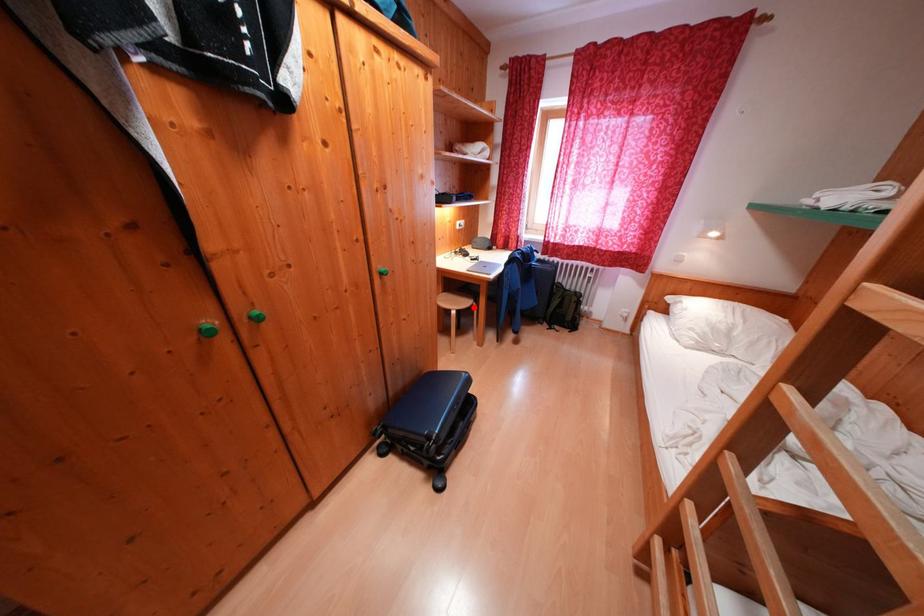
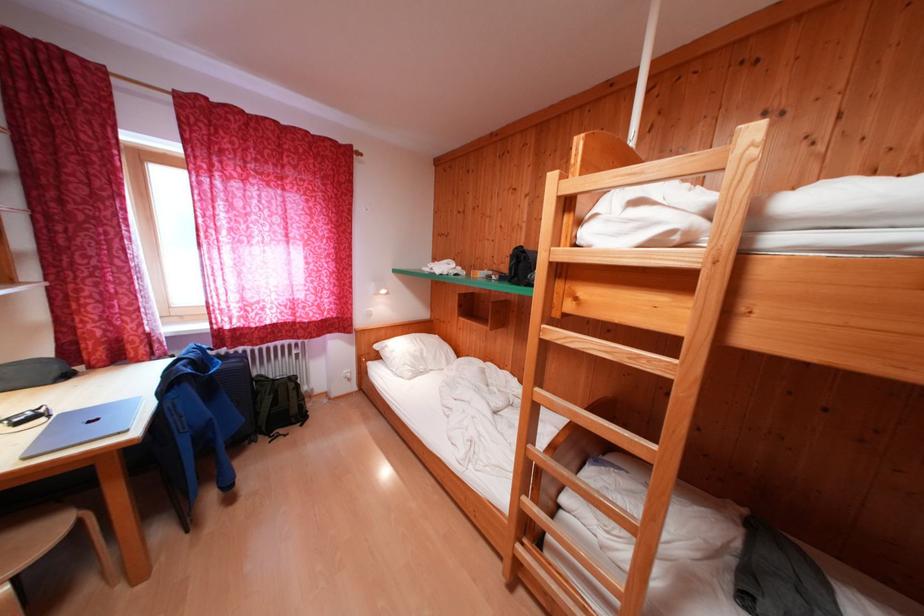
Where in the second image is the point corresponding to the highlighted location from the first image?

(55, 538)